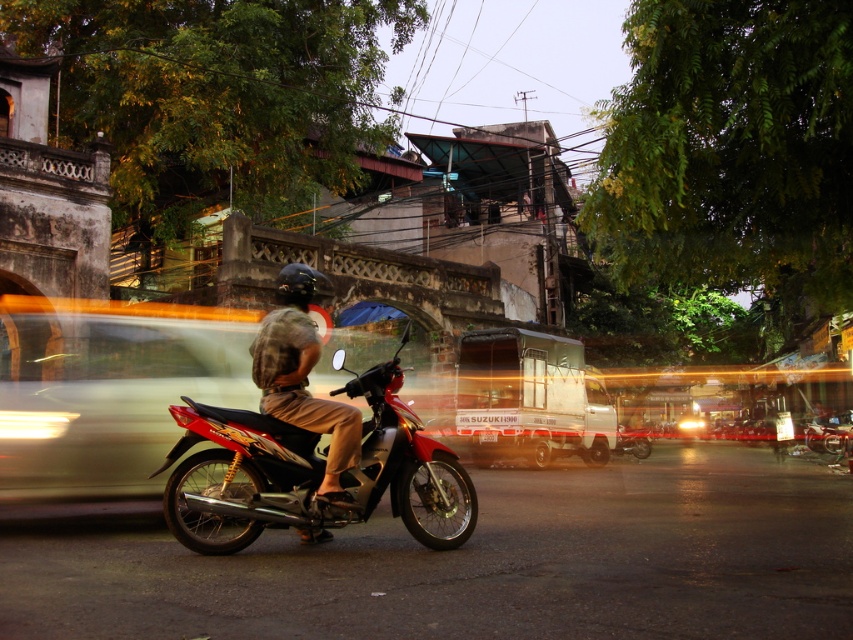
Question: Among these points, which one is nearest to the camera?

Choices:
 (A) (32, 477)
 (B) (303, 340)
 (C) (410, 416)

Answer: (B)

Question: Which of the following is the farthest from the observer?

Choices:
 (A) metallic silver car at left
 (B) camouflage fabric shirt at center

Answer: (A)

Question: Considering the real-world distances, which object is closest to the metallic silver car at left?

Choices:
 (A) shiny metallic motorcycle at center
 (B) camouflage fabric shirt at center

Answer: (A)

Question: Does shiny metallic motorcycle at center have a smaller size compared to camouflage fabric shirt at center?

Choices:
 (A) yes
 (B) no

Answer: (B)

Question: Is shiny metallic motorcycle at center positioned in front of camouflage fabric shirt at center?

Choices:
 (A) yes
 (B) no

Answer: (A)

Question: Does shiny metallic motorcycle at center appear on the left side of camouflage fabric shirt at center?

Choices:
 (A) no
 (B) yes

Answer: (A)